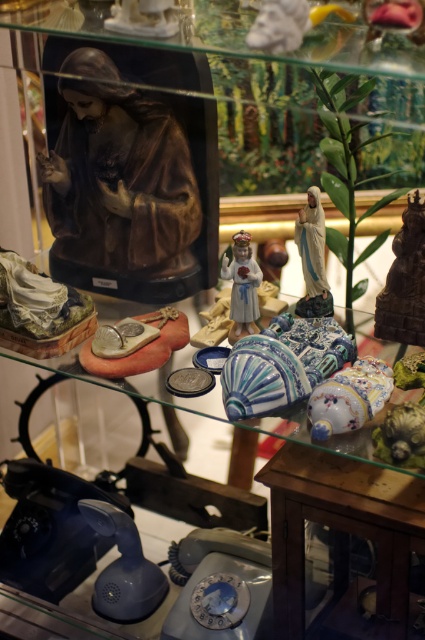
Question: Can you confirm if matte gold statue at right is positioned to the right of porcelain figurine at center?

Choices:
 (A) yes
 (B) no

Answer: (A)

Question: Is wooden cabinet at lower right to the left of matte gold statue at right from the viewer's perspective?

Choices:
 (A) yes
 (B) no

Answer: (A)

Question: Does matte brown statue at upper left appear over wooden cabinet at lower right?

Choices:
 (A) no
 (B) yes

Answer: (B)

Question: Among these objects, which one is nearest to the camera?

Choices:
 (A) wooden cabinet at lower right
 (B) matte gold statue at right
 (C) porcelain figurine at center

Answer: (A)

Question: Which object is the farthest from the matte brown statue at upper left?

Choices:
 (A) wooden cabinet at lower right
 (B) matte gold statue at right

Answer: (A)

Question: Among these objects, which one is farthest from the camera?

Choices:
 (A) porcelain figurine at center
 (B) wooden cabinet at lower right
 (C) matte gold statue at right
 (D) matte brown statue at upper left

Answer: (D)